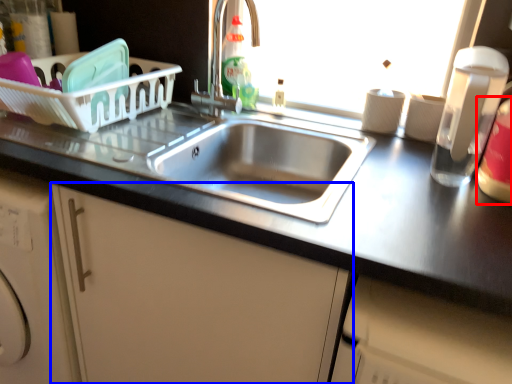
Question: Which object is closer to the camera taking this photo, bottle (highlighted by a red box) or cabinetry (highlighted by a blue box)?

Choices:
 (A) bottle
 (B) cabinetry

Answer: (B)